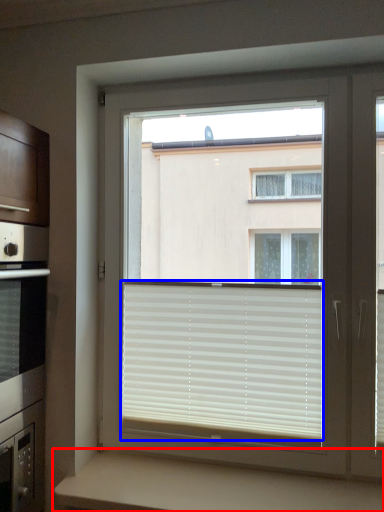
Question: Which of the following is the farthest to the observer, counter (highlighted by a red box) or window blind (highlighted by a blue box)?

Choices:
 (A) counter
 (B) window blind

Answer: (B)